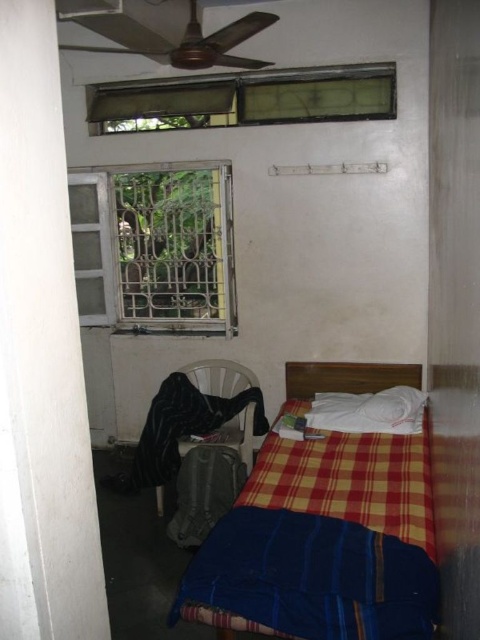
You are trying to decide whether to place a small rectangular box on the blue woven blanket at lower center or on the metallic bars at left. Based on their sizes, which surface can accommodate the box more comfortably?

The blue woven blanket at lower center is smaller than the metallic bars at left, so the metallic bars at left would provide a more comfortable and stable surface for the box since they are larger.

You are standing at the point marked by coordinates (311, 577) in the room. What object are you standing on?

You are standing on the blue woven blanket at lower center, as the coordinates point to that location.